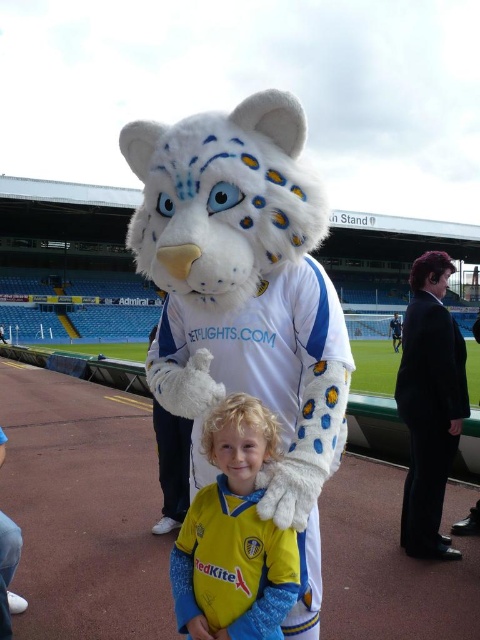
Question: Does yellow jersey at center come in front of black suit at right?

Choices:
 (A) no
 (B) yes

Answer: (B)

Question: Which point appears farthest from the camera in this image?

Choices:
 (A) (187, 620)
 (B) (430, 428)

Answer: (B)

Question: Can you confirm if yellow jersey at center is positioned below black suit at right?

Choices:
 (A) no
 (B) yes

Answer: (B)

Question: Is yellow jersey at center in front of black suit at right?

Choices:
 (A) no
 (B) yes

Answer: (B)

Question: Which object appears closest to the camera in this image?

Choices:
 (A) black suit at right
 (B) yellow jersey at center

Answer: (B)